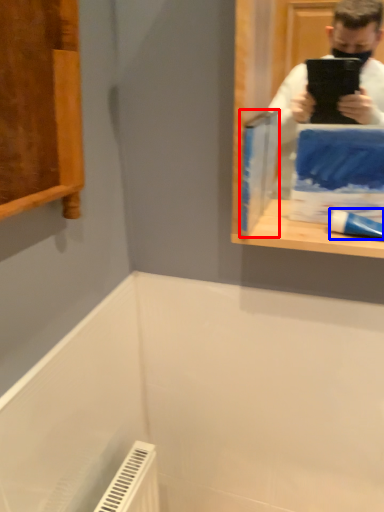
Question: Which point is further to the camera, paperback book (highlighted by a red box) or toothpaste (highlighted by a blue box)?

Choices:
 (A) paperback book
 (B) toothpaste

Answer: (A)